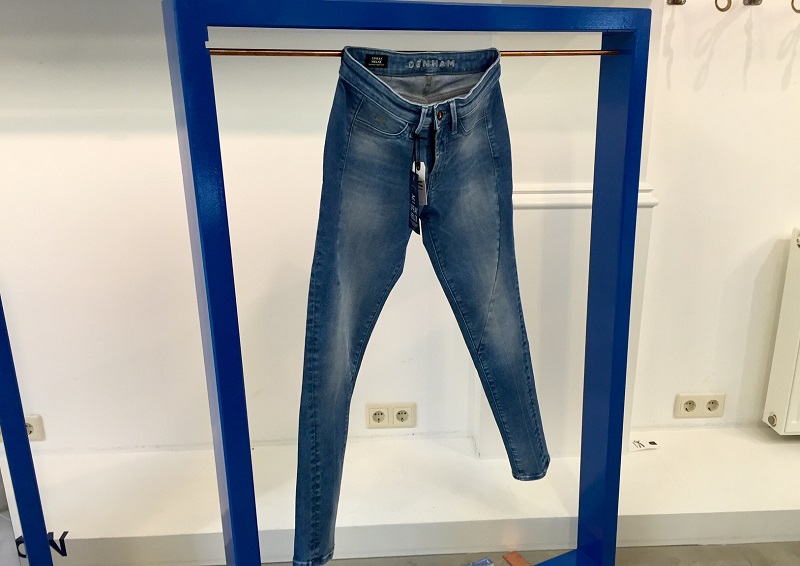
The image size is (800, 566). What are the coordinates of `trim` in the screenshot? It's located at click(x=557, y=200).